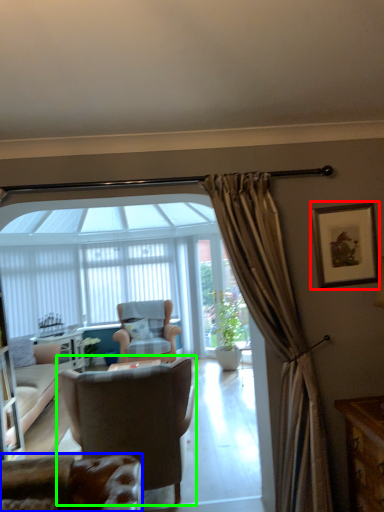
Question: Considering the real-world distances, which object is closest to picture frame (highlighted by a red box)? chair (highlighted by a blue box) or chair (highlighted by a green box).

Choices:
 (A) chair
 (B) chair

Answer: (B)